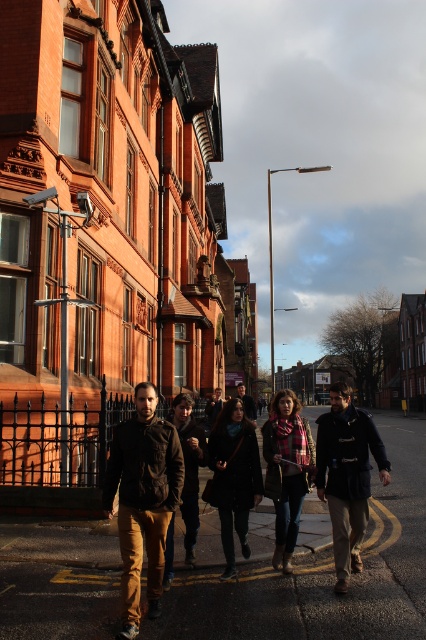
You are a tailor who needs to determine which garment requires more fabric. Based on the image, which of the following requires more fabric between the dark blue leather jacket at center and the black wool coat at center?

The dark blue leather jacket at center requires more fabric because it is larger in size than the black wool coat at center.

You are standing on the sidewalk in the street scene and want to walk towards the closer of the two points, point (230, 451) and point (242, 396). Which point should you head towards?

You should head towards point (230, 451) because it is closer to you than point (242, 396).

You are a fashion blogger analyzing the outfits in the image. You notice the brown suede jacket at center and the black wool coat at center. Which of these two items is positioned higher on the person wearing them?

The brown suede jacket at center is located above the black wool coat at center, so it is positioned higher on the person wearing them.